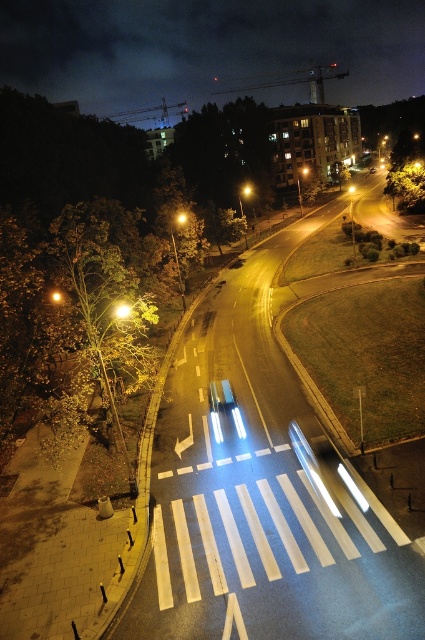
How distant is metallic streetlight at upper left from yellow plastic traffic light at center?

A distance of 107.52 meters exists between metallic streetlight at upper left and yellow plastic traffic light at center.

Is the position of metallic streetlight at upper left less distant than that of yellow plastic traffic light at center?

Yes, metallic streetlight at upper left is closer to the viewer.

Between point (122, 308) and point (351, 193), which one is positioned in front?

Point (122, 308) is more forward.

You are a GUI agent. You are given a task and a screenshot of the screen. Output one action in this format:
    pyautogui.click(x=<x>, y=<y>)
    Task: Click on the metallic streetlight at upper left
    The height and width of the screenshot is (640, 425).
    Given the screenshot: What is the action you would take?
    point(124,310)

Does shiny silver car at center appear on the right side of yellow matte streetlight at center?

Incorrect, shiny silver car at center is not on the right side of yellow matte streetlight at center.

Which of these two, shiny silver car at center or yellow matte streetlight at center, stands shorter?

With less height is shiny silver car at center.

Where is `shiny silver car at center`? The image size is (425, 640). shiny silver car at center is located at coordinates (221, 394).

Can you confirm if shiny silver car at center is shorter than yellowish glass traffic light at center?

Incorrect, shiny silver car at center's height does not fall short of yellowish glass traffic light at center's.

This screenshot has height=640, width=425. What do you see at coordinates (221, 394) in the screenshot?
I see `shiny silver car at center` at bounding box center [221, 394].

The width and height of the screenshot is (425, 640). Identify the location of shiny silver car at center. (221, 394).

Find the location of a particular element. The width and height of the screenshot is (425, 640). shiny silver car at center is located at coordinates (221, 394).